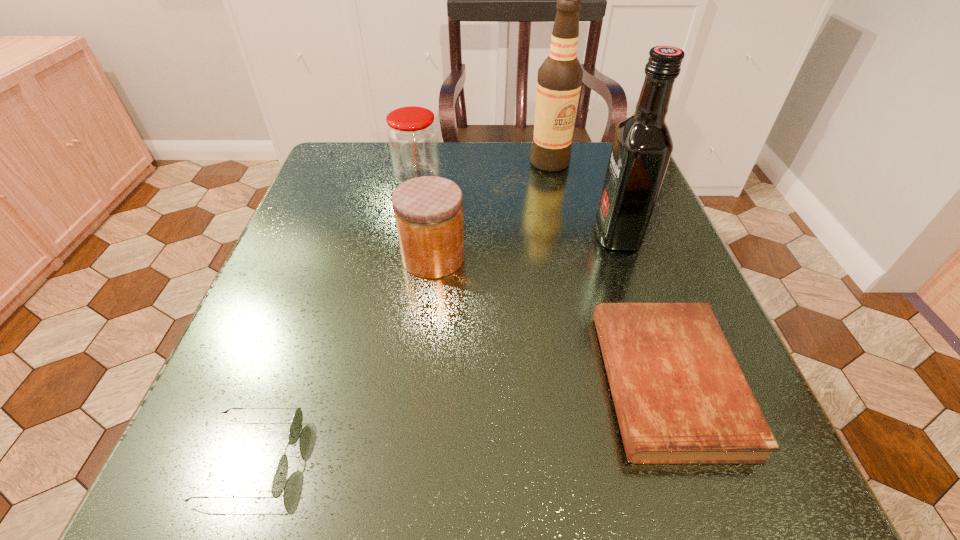
Where is `free spot between the liquor and the alcohol`? free spot between the liquor and the alcohol is located at coordinates (584, 199).

What are the coordinates of `vacant point located between the nearer jar and the Bible` in the screenshot? It's located at (550, 320).

Where is `vacant point located between the alcohol and the Bible`? vacant point located between the alcohol and the Bible is located at coordinates (609, 272).

At what (x,y) coordinates should I click in order to perform the action: click on object that ranks as the fourth closest to the alcohol. Please return your answer as a coordinate pair (x, y). Looking at the image, I should click on (680, 396).

This screenshot has height=540, width=960. In order to click on object that can be found as the fourth closest to the liquor in this screenshot , I will do `click(412, 137)`.

I want to click on vacant space that satisfies the following two spatial constraints: 1. on the label of the alcohol; 2. on the front-facing side of the sunglasses, so click(x=613, y=458).

Find the location of a particular element. free location that satisfies the following two spatial constraints: 1. on the front side of the farther jar; 2. on the front-facing side of the sunglasses is located at coordinates (367, 458).